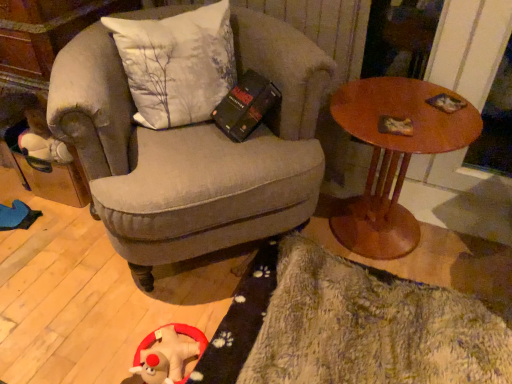
The image size is (512, 384). Identify the location of free space to the right of wooden round table at right. (468, 233).